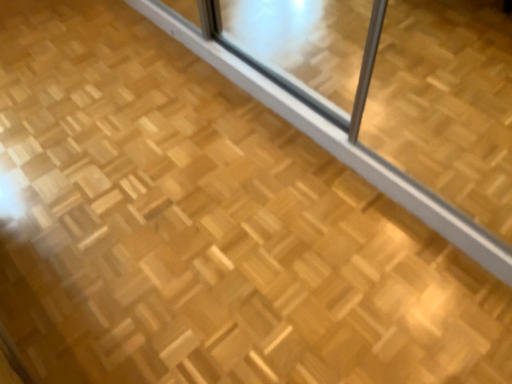
What do you see at coordinates (334, 141) in the screenshot? The image size is (512, 384). I see `transparent glass at upper center` at bounding box center [334, 141].

At what (x,y) coordinates should I click in order to perform the action: click on transparent glass at upper center. Please return your answer as a coordinate pair (x, y). The height and width of the screenshot is (384, 512). Looking at the image, I should click on (334, 141).

I want to click on transparent glass at upper center, so click(334, 141).